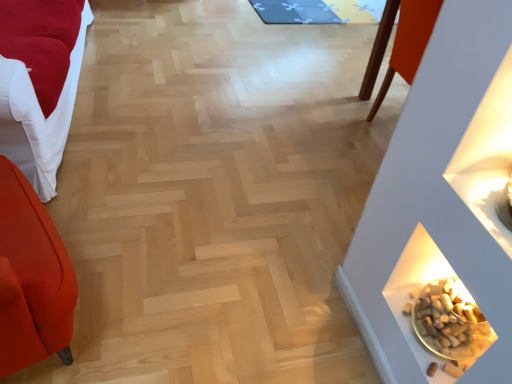
The image size is (512, 384). What do you see at coordinates (449, 323) in the screenshot?
I see `brown cork at lower right` at bounding box center [449, 323].

Find the location of a particular element. Image resolution: width=512 pixels, height=384 pixels. velvet red sofa at left is located at coordinates (39, 83).

Is velvet red sofa at left wider or thinner than blue fabric mat at upper center?

Considering their sizes, velvet red sofa at left looks slimmer than blue fabric mat at upper center.

Considering the relative sizes of velvet red sofa at left and blue fabric mat at upper center in the image provided, is velvet red sofa at left shorter than blue fabric mat at upper center?

Incorrect, the height of velvet red sofa at left does not fall short of that of blue fabric mat at upper center.

From the image's perspective, is velvet red sofa at left located above or below blue fabric mat at upper center?

velvet red sofa at left is situated lower than blue fabric mat at upper center in the image.

Which of these two, velvet red sofa at left or blue fabric mat at upper center, is bigger?

velvet red sofa at left is bigger.

From a real-world perspective, which is physically below, blue fabric mat at upper center or velvet red sofa at left?

In real-world perspective, blue fabric mat at upper center is lower.

Could you tell me if blue fabric mat at upper center is turned towards velvet red sofa at left?

No.

Between blue fabric mat at upper center and velvet red sofa at left, which one appears on the right side from the viewer's perspective?

blue fabric mat at upper center is more to the right.

Is blue fabric mat at upper center bigger than velvet red sofa at left?

Incorrect, blue fabric mat at upper center is not larger than velvet red sofa at left.

Considering the sizes of objects brown cork at lower right and blue fabric mat at upper center in the image provided, who is smaller, brown cork at lower right or blue fabric mat at upper center?

With smaller size is brown cork at lower right.

From the image's perspective, is brown cork at lower right on blue fabric mat at upper center?

No, from the image's perspective, brown cork at lower right is not above blue fabric mat at upper center.

Where is `food positioned vertically above the blue fabric mat at upper center (from a real-world perspective)`? Image resolution: width=512 pixels, height=384 pixels. food positioned vertically above the blue fabric mat at upper center (from a real-world perspective) is located at coordinates (449, 323).

Which of these two, brown cork at lower right or blue fabric mat at upper center, is thinner?

Thinner between the two is brown cork at lower right.

Which of these two, velvet red sofa at left or brown cork at lower right, is wider?

With larger width is velvet red sofa at left.

Which is more to the left, velvet red sofa at left or brown cork at lower right?

Positioned to the left is velvet red sofa at left.

Which is behind, velvet red sofa at left or brown cork at lower right?

brown cork at lower right is behind.

Is brown cork at lower right at the back of blue fabric mat at upper center?

No, blue fabric mat at upper center's orientation is not away from brown cork at lower right.

Are blue fabric mat at upper center and brown cork at lower right located far from each other?

Yes, blue fabric mat at upper center is far from brown cork at lower right.

From the picture: From a real-world perspective, who is located higher, blue fabric mat at upper center or brown cork at lower right?

brown cork at lower right.

The height and width of the screenshot is (384, 512). In order to click on food on the left of the blue fabric mat at upper center in this screenshot , I will do `click(449, 323)`.

From a real-world perspective, does brown cork at lower right stand above velvet red sofa at left?

No, from a real-world perspective, brown cork at lower right is not over velvet red sofa at left

Is brown cork at lower right positioned before velvet red sofa at left?

That is False.

Identify the location of mat on the right side of velvet red sofa at left. This screenshot has width=512, height=384. (317, 11).

Image resolution: width=512 pixels, height=384 pixels. I want to click on furniture below the blue fabric mat at upper center (from the image's perspective), so click(39, 83).

Which object lies nearer to the anchor point velvet red sofa at left, blue fabric mat at upper center or brown cork at lower right?

brown cork at lower right lies closer to velvet red sofa at left than the other object.

Looking at the image, which one is located closer to brown cork at lower right, blue fabric mat at upper center or velvet red sofa at left?

The object closer to brown cork at lower right is velvet red sofa at left.

Based on the photo, when comparing their distances from brown cork at lower right, does velvet red sofa at left or blue fabric mat at upper center seem closer?

Among the two, velvet red sofa at left is located nearer to brown cork at lower right.

Estimate the real-world distances between objects in this image. Which object is further from blue fabric mat at upper center, velvet red sofa at left or brown cork at lower right?

brown cork at lower right lies further to blue fabric mat at upper center than the other object.

Looking at the image, which one is located further to velvet red sofa at left, brown cork at lower right or blue fabric mat at upper center?

The object further to velvet red sofa at left is blue fabric mat at upper center.

From the image, which object appears to be farther from blue fabric mat at upper center, brown cork at lower right or velvet red sofa at left?

brown cork at lower right.

Find the location of a particular element. food between velvet red sofa at left and blue fabric mat at upper center from front to back is located at coordinates (449, 323).